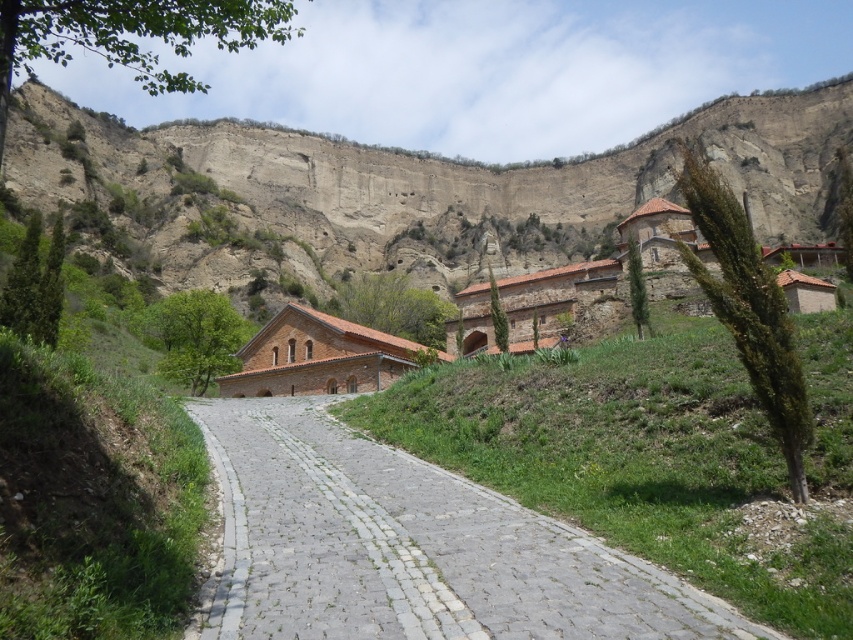
You are a hiker who wants to take a photo of the rustic stone cliff at upper center while standing on the gray cobblestone path at center. Can you see the entire cliff without moving from your current position?

The rustic stone cliff at upper center is above the gray cobblestone path at center, so yes, you can see the entire cliff from your current position on the path without needing to move.

You are a hiker planning to walk along the gray cobblestone path at center. You want to know if the rustic stone cliff at upper center is a significant landmark in the area. Based on the scene, can you determine if the cliff is larger than the path?

The rustic stone cliff at upper center is bigger than the gray cobblestone path at center, so yes, the cliff is a significant landmark as it is larger in size compared to the path.